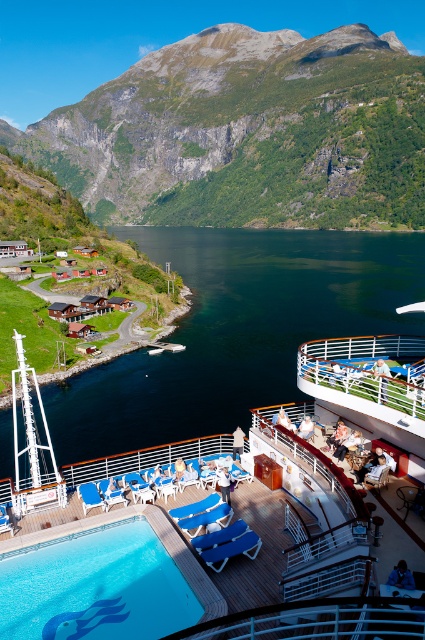
You are a passenger on the cruise ship and want to take a photo of the green textured mountain at upper left and the dark blue water at center. Which object should you point your camera upwards to capture?

To capture the green textured mountain at upper left, you should point your camera upwards since it is located above the dark blue water at center.

You are a photographer planning to capture the entire view of the cruise ship deck and the fjord. Based on the scene, which object between the green textured mountain at upper left and the dark blue water at center should you focus on to ensure both the cruise ship deck and the fjord are fully visible in your photo?

The green textured mountain at upper left might be wider than dark blue water at center, so focusing on the green textured mountain at upper left would help ensure both the cruise ship deck and the fjord are fully visible in the photo.